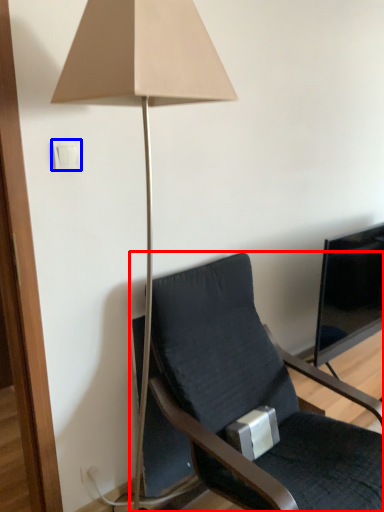
Question: Which object appears farthest to the camera in this image, chair (highlighted by a red box) or light switch (highlighted by a blue box)?

Choices:
 (A) chair
 (B) light switch

Answer: (B)